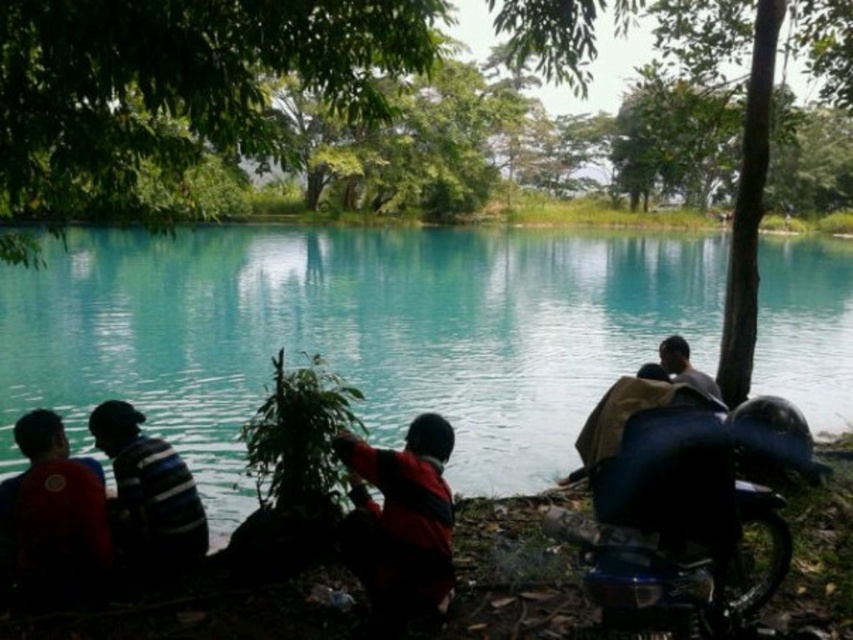
Between point (688, 397) and point (136, 563), which one is positioned in front?

Positioned in front is point (688, 397).

Is point (729, 614) behind point (137, 547)?

That is False.

In the scene shown: Who is more forward, (688, 628) or (129, 547)?

Point (688, 628) is more forward.

What are the coordinates of `shiny black motorcycle at lower right` in the screenshot? It's located at tap(683, 506).

Measure the distance between point (688, 291) and camera.

Point (688, 291) and camera are 33.89 meters apart from each other.

In order to click on teal glossy water at center in this screenshot , I will do `click(351, 336)`.

Is point (397, 534) farther from viewer compared to point (683, 348)?

No, (397, 534) is in front of (683, 348).

Which is in front, point (395, 531) or point (680, 380)?

Point (395, 531) is more forward.

The width and height of the screenshot is (853, 640). What do you see at coordinates (399, 518) in the screenshot?
I see `red matte jacket at center` at bounding box center [399, 518].

Find the location of a particular element. red matte jacket at center is located at coordinates (399, 518).